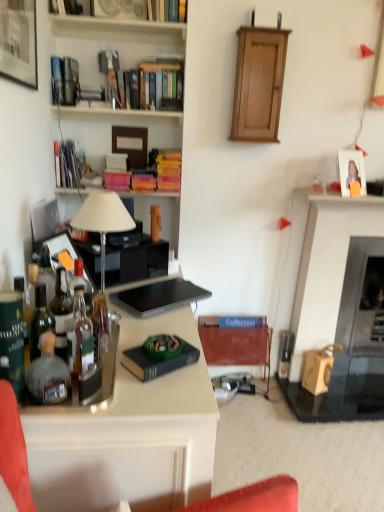
Locate an element on the screen. This screenshot has width=384, height=512. wooden bookshelf at upper center, which ranks as the first shelf in top-to-bottom order is located at coordinates (116, 26).

At what (x,y) coordinates should I click in order to perform the action: click on wooden bookshelf at upper center, the first shelf in the bottom-to-top sequence. Please return your answer as a coordinate pair (x, y). The image size is (384, 512). Looking at the image, I should click on (112, 111).

The height and width of the screenshot is (512, 384). In order to click on translucent glass bottle at left, placed as the first bottle when sorted from back to front in this screenshot , I will do `click(81, 286)`.

Find the location of a particular element. The height and width of the screenshot is (512, 384). hardcover books at upper center, the 2th shelf positioned from the top is located at coordinates (140, 91).

Measure the distance between point (56, 303) and camera.

4.73 feet.

What do you see at coordinates (158, 297) in the screenshot?
I see `black matte laptop at center` at bounding box center [158, 297].

You are a GUI agent. You are given a task and a screenshot of the screen. Output one action in this format:
    pyautogui.click(x=<x>, y=<y>)
    Task: Click on the pink matte book at upper left, acting as the sixth book starting from the top
    The height and width of the screenshot is (512, 384).
    Given the screenshot: What is the action you would take?
    pyautogui.click(x=117, y=173)

Find the location of a particular element. The image size is (384, 512). white plastic picture frame at upper right, which is the first picture frame in bottom-to-top order is located at coordinates (351, 170).

Identify the location of wooden bookshelf at upper center, the 3th shelf ordered from the bottom. Image resolution: width=384 pixels, height=512 pixels. (116, 26).

Can you confirm if wooden fireplace at right is wider than blue hardcover book at center, which is the first book in bottom-to-top order?

Yes.

Is the position of wooden fireplace at right more distant than that of blue hardcover book at center, the eighth book positioned from the top?

No, wooden fireplace at right is closer to the viewer.

Considering the relative sizes of wooden fireplace at right and blue hardcover book at center, the eighth book positioned from the top, in the image provided, is wooden fireplace at right bigger than blue hardcover book at center, the eighth book positioned from the top,?

Correct, wooden fireplace at right is larger in size than blue hardcover book at center, the eighth book positioned from the top.

Is translucent glass bottles at left, marked as the 2th bottle in a back-to-front arrangement, inside the boundaries of light brown wood cabinet at upper center, or outside?

translucent glass bottles at left, marked as the 2th bottle in a back-to-front arrangement, is outside light brown wood cabinet at upper center.

From a real-world perspective, between translucent glass bottles at left, the third bottle when ordered from front to back, and light brown wood cabinet at upper center, who is vertically lower?

From a 3D spatial view, translucent glass bottles at left, the third bottle when ordered from front to back, is below.

From the image's perspective, is translucent glass bottles at left, marked as the 2th bottle in a back-to-front arrangement, located above or below light brown wood cabinet at upper center?

From the image's perspective, translucent glass bottles at left, marked as the 2th bottle in a back-to-front arrangement, appears below light brown wood cabinet at upper center.

Measure the distance from translucent glass bottles at left, the third bottle when ordered from front to back, to light brown wood cabinet at upper center.

A distance of 4.61 feet exists between translucent glass bottles at left, the third bottle when ordered from front to back, and light brown wood cabinet at upper center.

From the image's perspective, which one is positioned higher, pink matte book at upper left, acting as the sixth book starting from the top, or hardcover book at upper center, placed as the 1th book when sorted from top to bottom?

hardcover book at upper center, placed as the 1th book when sorted from top to bottom, from the image's perspective.

Is pink matte book at upper left, which is the 3th book in bottom-to-top order, next to hardcover book at upper center, marked as the eighth book in a bottom-to-top arrangement, and touching it?

No, pink matte book at upper left, which is the 3th book in bottom-to-top order, is not beside hardcover book at upper center, marked as the eighth book in a bottom-to-top arrangement.

Considering the sizes of pink matte book at upper left, acting as the sixth book starting from the top, and hardcover book at upper center, marked as the eighth book in a bottom-to-top arrangement, in the image, is pink matte book at upper left, acting as the sixth book starting from the top, taller or shorter than hardcover book at upper center, marked as the eighth book in a bottom-to-top arrangement,?

Considering their sizes, pink matte book at upper left, acting as the sixth book starting from the top, has more height than hardcover book at upper center, marked as the eighth book in a bottom-to-top arrangement.

Can you tell me how much pink matte book at upper left, which is the 3th book in bottom-to-top order, and hardcover book at upper center, placed as the 1th book when sorted from top to bottom, differ in facing direction?

6.59 degrees separate the facing orientations of pink matte book at upper left, which is the 3th book in bottom-to-top order, and hardcover book at upper center, placed as the 1th book when sorted from top to bottom.

Is point (151, 60) closer or farther from the camera than point (76, 260)?

Point (151, 60) appears to be farther away from the viewer than point (76, 260).

Does hardcover books at upper center, the 2th shelf positioned from the top, come in front of translucent glass bottle at left, placed as the first bottle when sorted from back to front?

No.

From a real-world perspective, does hardcover books at upper center, the 2th shelf positioned from the top, sit lower than translucent glass bottle at left, placed as the first bottle when sorted from back to front?

Incorrect, from a real-world perspective, hardcover books at upper center, the 2th shelf positioned from the top, is higher than translucent glass bottle at left, placed as the first bottle when sorted from back to front.

Consider the image. Is translucent glass bottle at left, positioned as the 2th bottle in front-to-back order, in front of or behind white plastic picture frame at upper right, the 1th picture frame from the back, in the image?

Visually, translucent glass bottle at left, positioned as the 2th bottle in front-to-back order, is located in front of white plastic picture frame at upper right, the 1th picture frame from the back.

Which object is thinner, translucent glass bottle at left, which ranks as the third bottle in back-to-front order, or white plastic picture frame at upper right, the second picture frame positioned from the front?

With smaller width is white plastic picture frame at upper right, the second picture frame positioned from the front.

Can you tell me how much translucent glass bottle at left, positioned as the 2th bottle in front-to-back order, and white plastic picture frame at upper right, acting as the 1th picture frame starting from the right, differ in facing direction?

The angular difference between translucent glass bottle at left, positioned as the 2th bottle in front-to-back order, and white plastic picture frame at upper right, acting as the 1th picture frame starting from the right, is 61.7 degrees.

Considering the sizes of objects translucent glass bottle at left, which ranks as the third bottle in back-to-front order, and white plastic picture frame at upper right, which ranks as the second picture frame in top-to-bottom order, in the image provided, who is taller, translucent glass bottle at left, which ranks as the third bottle in back-to-front order, or white plastic picture frame at upper right, which ranks as the second picture frame in top-to-bottom order,?

translucent glass bottle at left, which ranks as the third bottle in back-to-front order.

From a real-world perspective, which is physically below, light brown wood cabinet at upper center or hardcover book at upper left, which appears as the 5th book when ordered from the bottom?

hardcover book at upper left, which appears as the 5th book when ordered from the bottom.

Is hardcover book at upper left, which appears as the 5th book when ordered from the bottom, inside light brown wood cabinet at upper center?

No, hardcover book at upper left, which appears as the 5th book when ordered from the bottom, is located outside of light brown wood cabinet at upper center.

Considering the relative sizes of light brown wood cabinet at upper center and hardcover book at upper left, which appears as the 5th book when ordered from the bottom, in the image provided, is light brown wood cabinet at upper center bigger than hardcover book at upper left, which appears as the 5th book when ordered from the bottom,?

Yes, light brown wood cabinet at upper center is bigger than hardcover book at upper left, which appears as the 5th book when ordered from the bottom.

Could you tell me if light brown wood cabinet at upper center is turned towards hardcover book at upper left, the fourth book when ordered from top to bottom?

No, light brown wood cabinet at upper center is not facing towards hardcover book at upper left, the fourth book when ordered from top to bottom.

Can you tell me how much hardcover book at upper left, which is counted as the 3th book, starting from the top, and yellow matte book at center, acting as the fourth book starting from the bottom, differ in facing direction?

hardcover book at upper left, which is counted as the 3th book, starting from the top, and yellow matte book at center, acting as the fourth book starting from the bottom, are facing 0.00165 degrees away from each other.

In the image, is hardcover book at upper left, which appears as the 6th book when ordered from the bottom, positioned in front of or behind yellow matte book at center, which is the 5th book from top to bottom?

Clearly, hardcover book at upper left, which appears as the 6th book when ordered from the bottom, is in front of yellow matte book at center, which is the 5th book from top to bottom.

Would you say hardcover book at upper left, which appears as the 6th book when ordered from the bottom, is outside yellow matte book at center, which is the 5th book from top to bottom?

Yes, hardcover book at upper left, which appears as the 6th book when ordered from the bottom, is outside of yellow matte book at center, which is the 5th book from top to bottom.

Does hardcover book at upper left, which is counted as the 3th book, starting from the top, have a greater height compared to yellow matte book at center, acting as the fourth book starting from the bottom?

Indeed, hardcover book at upper left, which is counted as the 3th book, starting from the top, has a greater height compared to yellow matte book at center, acting as the fourth book starting from the bottom.

Find the location of a particular element. This screenshot has height=512, width=384. fireplace above the blue hardcover book at center, the eighth book positioned from the top (from a real-world perspective) is located at coordinates (337, 310).

Where is `bottle that is the 4th one when counting leftward from the light brown wood cabinet at upper center`? bottle that is the 4th one when counting leftward from the light brown wood cabinet at upper center is located at coordinates (61, 312).

Based on their spatial positions, is wooden fireplace at right or translucent glass bottles at left, marked as the 2th bottle in a back-to-front arrangement, closer to hardcover book at upper left, which appears as the 5th book when ordered from the bottom?

translucent glass bottles at left, marked as the 2th bottle in a back-to-front arrangement, is positioned closer to the anchor hardcover book at upper left, which appears as the 5th book when ordered from the bottom.

From the image, which object appears to be farther from white glossy desk at lower left, blue hardcover book at center, which appears as the second book when ordered from the bottom, or translucent glass bottle at left, positioned as the 2th bottle in front-to-back order?

Among the two, translucent glass bottle at left, positioned as the 2th bottle in front-to-back order, is located further to white glossy desk at lower left.

When comparing their distances from hardcover book at upper center, marked as the eighth book in a bottom-to-top arrangement, does hardcover books at upper center, which ranks as the second shelf in bottom-to-top order, or white plastic picture frame at upper right, which is the first picture frame in bottom-to-top order, seem further?

The object further to hardcover book at upper center, marked as the eighth book in a bottom-to-top arrangement, is white plastic picture frame at upper right, which is the first picture frame in bottom-to-top order.

Which object lies further to the anchor point pink matte book at upper left, which is the 3th book in bottom-to-top order, translucent glass bottle at left, which is the fourth bottle in front-to-back order, or black matte laptop at center?

Based on the image, translucent glass bottle at left, which is the fourth bottle in front-to-back order, appears to be further to pink matte book at upper left, which is the 3th book in bottom-to-top order.

When comparing their distances from translucent glass bottle at left, positioned as the 2th bottle in front-to-back order, does hardcover book at upper left, which appears as the 6th book when ordered from the bottom, or hardcover books at upper center, the 2th book viewed from the top, seem closer?

Based on the image, hardcover book at upper left, which appears as the 6th book when ordered from the bottom, appears to be nearer to translucent glass bottle at left, positioned as the 2th bottle in front-to-back order.

From the image, which object appears to be farther from hardcover book at upper center, marked as the eighth book in a bottom-to-top arrangement, white glossy desk at lower left or hardcover book at upper left, which is counted as the 3th book, starting from the top?

white glossy desk at lower left is further to hardcover book at upper center, marked as the eighth book in a bottom-to-top arrangement.

In the scene shown: Looking at the image, which one is located closer to black matte laptop at center, wooden fireplace at right or white glossy lamp at upper left?

The object closer to black matte laptop at center is white glossy lamp at upper left.

From the image, which object appears to be farther from light brown wood cabinet at upper center, wooden fireplace at right or pink matte book at upper left, acting as the sixth book starting from the top?

wooden fireplace at right.

Where is `cabinetry between wooden bookshelf at upper center, which ranks as the first shelf in top-to-bottom order, and black matte laptop at center from top to bottom`? The image size is (384, 512). cabinetry between wooden bookshelf at upper center, which ranks as the first shelf in top-to-bottom order, and black matte laptop at center from top to bottom is located at coordinates (258, 84).

Identify the location of shelf that lies between wooden bookshelf at upper center, the 3th shelf ordered from the bottom, and wooden bookshelf at upper center, which is the third shelf from top to bottom, from top to bottom. The height and width of the screenshot is (512, 384). (140, 91).

You are a GUI agent. You are given a task and a screenshot of the screen. Output one action in this format:
    pyautogui.click(x=<x>, y=<y>)
    Task: Click on the shelf that lies between matte black picture frame at upper left, which is the first picture frame from left to right, and translucent glass bottles at left, marked as the 2th bottle in a back-to-front arrangement, from top to bottom
    This screenshot has width=384, height=512.
    Given the screenshot: What is the action you would take?
    pyautogui.click(x=112, y=111)

You are a GUI agent. You are given a task and a screenshot of the screen. Output one action in this format:
    pyautogui.click(x=<x>, y=<y>)
    Task: Click on the bottle between hardcover books at upper center, which ranks as the second shelf in bottom-to-top order, and black matte laptop at center vertically
    
    Given the screenshot: What is the action you would take?
    [x=81, y=286]